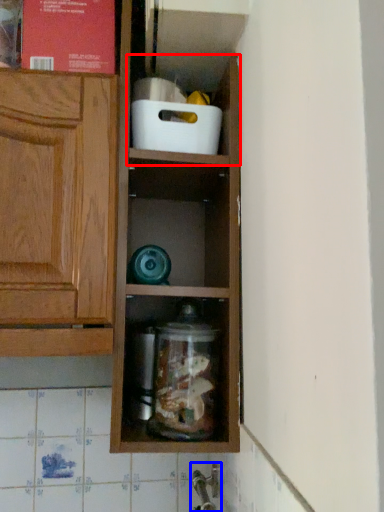
Question: Among these objects, which one is nearest to the camera, cabinet (highlighted by a red box) or faucet (highlighted by a blue box)?

Choices:
 (A) cabinet
 (B) faucet

Answer: (B)